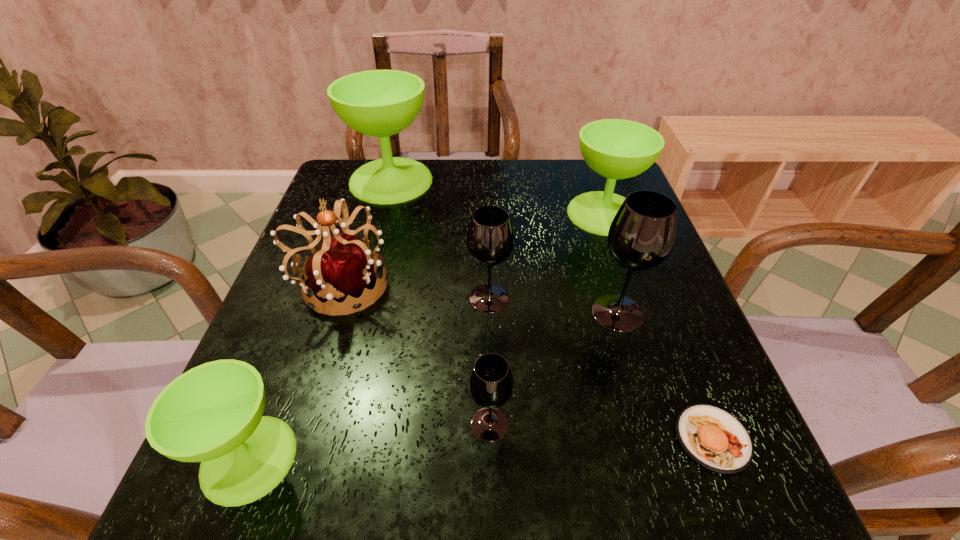
Identify the location of vacant space located 0.310m on the front-facing side of the tiara. (540, 285).

Where is `vacant space located on the front of the second smallest green wineglass`? The height and width of the screenshot is (540, 960). vacant space located on the front of the second smallest green wineglass is located at coordinates (x=636, y=306).

Locate an element on the screen. free region located on the left of the second smallest gray wineglass is located at coordinates (365, 298).

Locate an element on the screen. Image resolution: width=960 pixels, height=540 pixels. free region located on the left of the nearest gray wineglass is located at coordinates (299, 424).

Find the location of a particular element. free spot located on the right of the smallest green wineglass is located at coordinates (342, 458).

Locate an element on the screen. The image size is (960, 540). vacant area situated on the left of the shortest object is located at coordinates (481, 438).

You are a GUI agent. You are given a task and a screenshot of the screen. Output one action in this format:
    pyautogui.click(x=<x>, y=<y>)
    Task: Click on the wineglass situated at the near edge
    The width and height of the screenshot is (960, 540).
    Given the screenshot: What is the action you would take?
    pyautogui.click(x=213, y=413)

Where is `patty that is at the near edge`? This screenshot has height=540, width=960. patty that is at the near edge is located at coordinates (714, 438).

Where is `tiara that is at the left edge`? This screenshot has height=540, width=960. tiara that is at the left edge is located at coordinates (342, 267).

At what (x,y) coordinates should I click in order to perform the action: click on patty situated at the right edge. Please return your answer as a coordinate pair (x, y). Looking at the image, I should click on pos(714,438).